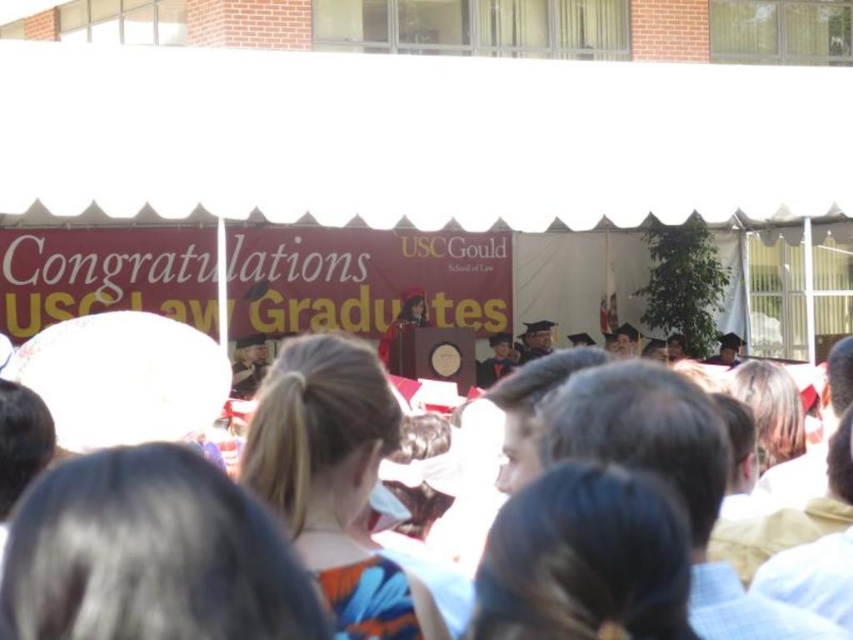
Can you confirm if white fabric canopy at upper center is positioned below white cloth crowd at center?

Actually, white fabric canopy at upper center is above white cloth crowd at center.

Does white fabric canopy at upper center appear on the left side of white cloth crowd at center?

Correct, you'll find white fabric canopy at upper center to the left of white cloth crowd at center.

Where is `white fabric canopy at upper center`? white fabric canopy at upper center is located at coordinates (418, 138).

At what (x,y) coordinates should I click in order to perform the action: click on white fabric canopy at upper center. Please return your answer as a coordinate pair (x, y). This screenshot has width=853, height=640. Looking at the image, I should click on (418, 138).